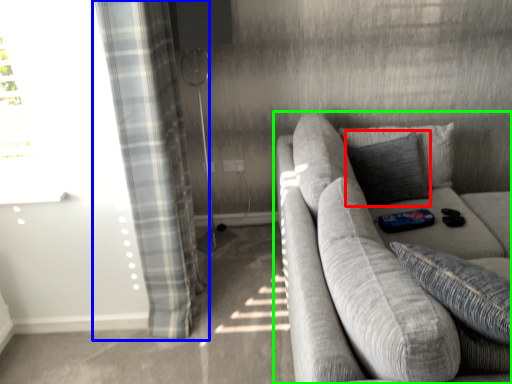
Question: Estimate the real-world distances between objects in this image. Which object is closer to pillow (highlighted by a red box), curtain (highlighted by a blue box) or studio couch (highlighted by a green box)?

Choices:
 (A) curtain
 (B) studio couch

Answer: (B)